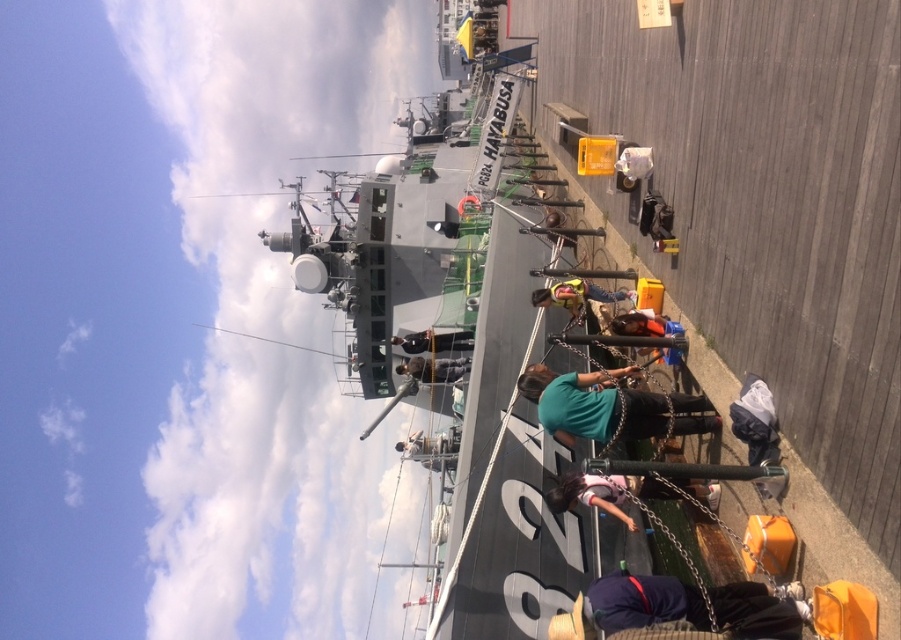
You are a photographer on the pier trying to capture a clear photo of the HAYABUSA ship. There are two items blocking your view slightly at the center of your frame. What can you do to reduce the obstruction caused by the yellow fabric bag at center and the dark green uniform at center?

Since the yellow fabric bag at center is smaller than the dark green uniform at center, you can move the yellow fabric bag at center to a side to minimize its obstruction while keeping the larger dark green uniform at center in place if needed, or adjust your position to avoid both items.